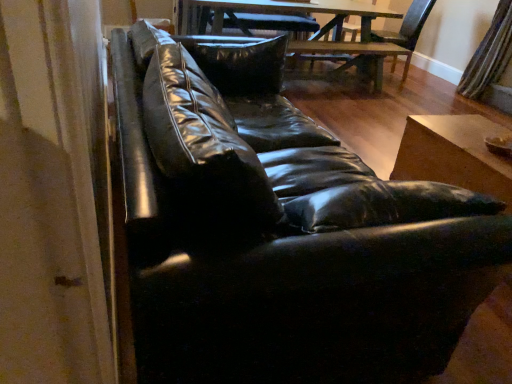
I want to click on vacant point above wooden table at lower right, which is counted as the first table, starting from the front (from a real-world perspective), so click(x=477, y=138).